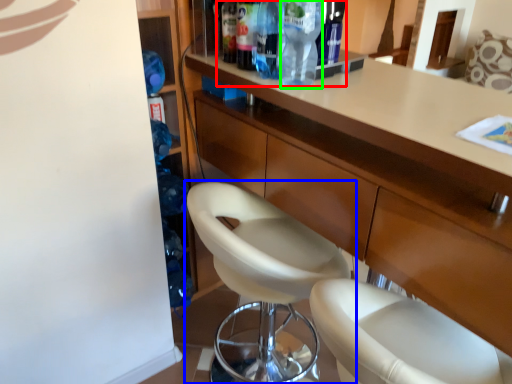
Question: Which is farther away from bottle (highlighted by a red box)? chair (highlighted by a blue box) or bottle (highlighted by a green box)?

Choices:
 (A) chair
 (B) bottle

Answer: (A)